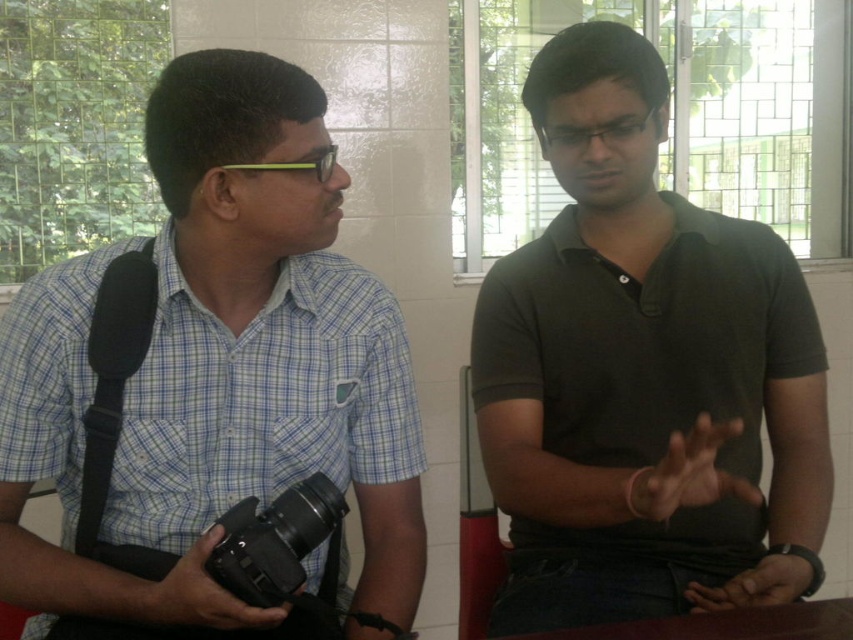
You are a photographer needing to adjust the focus of your matte black camera at lower left. The subject is the dark green polo shirt at center. Based on the distance between them, can you confirm if the camera can capture the subject in focus without moving closer?

The dark green polo shirt at center is 16.29 inches away from the matte black camera at lower left. Most cameras can focus within this distance, so yes, the camera can capture the subject in focus without moving closer.

You are a photographer trying to capture a group photo of the two people in the scene. Since you want everyone to face the camera, where should the photographer position themselves relative to the blue checkered shirt at left and dark green polo shirt at center?

The photographer should position themselves to the right of both the blue checkered shirt at left and dark green polo shirt at center so that both individuals can face the camera without turning away.

You are a photographer trying to decide where to place your matte black camera at lower left so it doesn t get in the way of the blue checkered shirt at left. Considering their sizes, which object should be placed closer to the edge to avoid blocking the other?

The blue checkered shirt at left is bigger than the matte black camera at lower left, so placing the matte black camera at lower left closer to the edge would prevent it from being blocked by the larger shirt.